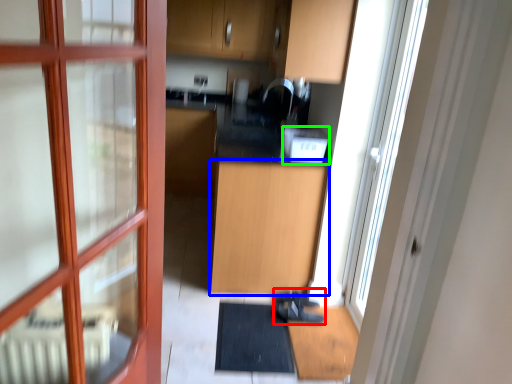
Question: Based on their relative distances, which object is farther from shoe (highlighted by a red box)? Choose from cabinetry (highlighted by a blue box) and appliance (highlighted by a green box).

Choices:
 (A) cabinetry
 (B) appliance

Answer: (B)